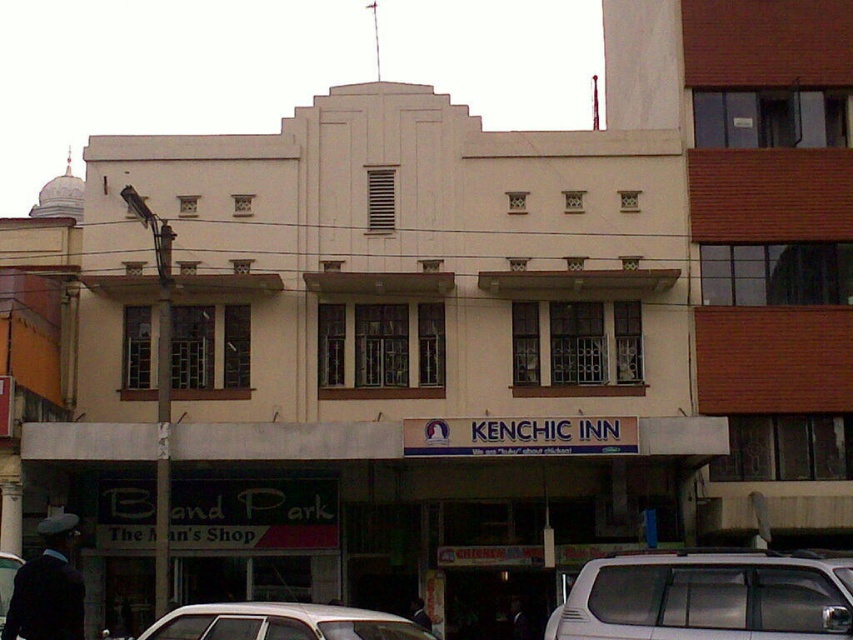
Can you confirm if white matte van at lower right is positioned to the left of white matte car at center?

Incorrect, white matte van at lower right is not on the left side of white matte car at center.

Locate an element on the screen. white matte van at lower right is located at coordinates (708, 596).

Based on the photo, is white matte van at lower right to the left of dark blue suit at lower left from the viewer's perspective?

No, white matte van at lower right is not to the left of dark blue suit at lower left.

Who is positioned more to the right, white matte van at lower right or dark blue suit at lower left?

white matte van at lower right

Locate an element on the screen. The image size is (853, 640). white matte van at lower right is located at coordinates (708, 596).

Identify the location of white matte van at lower right. (708, 596).

From the picture: Is white matte car at center below dark blue suit at lower left?

Indeed, white matte car at center is positioned under dark blue suit at lower left.

Between point (354, 611) and point (79, 632), which one is positioned behind?

The point (354, 611) is more distant.

The image size is (853, 640). Describe the element at coordinates (280, 621) in the screenshot. I see `white matte car at center` at that location.

Locate an element on the screen. The width and height of the screenshot is (853, 640). white matte car at center is located at coordinates (280, 621).